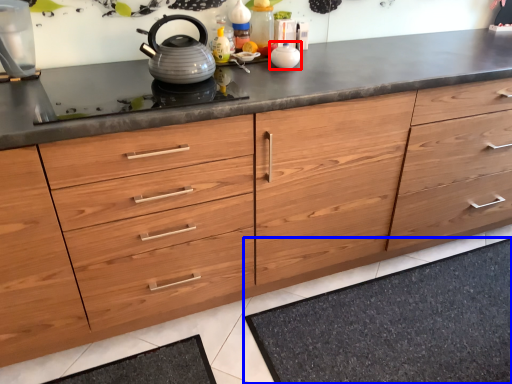
Question: Which of the following is the closest to the observer, appliance (highlighted by a red box) or bath mat (highlighted by a blue box)?

Choices:
 (A) appliance
 (B) bath mat

Answer: (B)